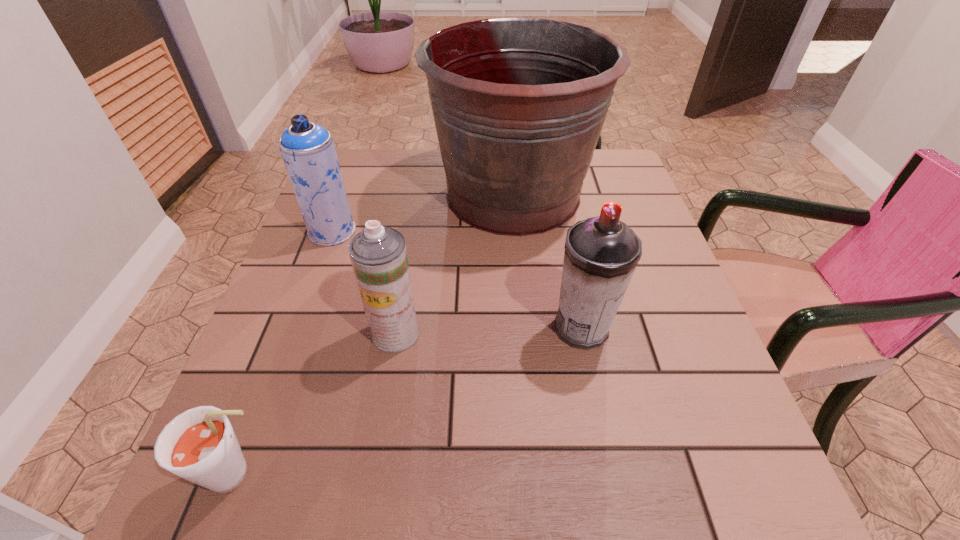
Where is `vacant space located 0.130m on the drink side of the shortest object`? This screenshot has height=540, width=960. vacant space located 0.130m on the drink side of the shortest object is located at coordinates (365, 475).

Where is `object positioned at the far edge`? object positioned at the far edge is located at coordinates (519, 104).

Locate an element on the screen. The width and height of the screenshot is (960, 540). object that is at the near edge is located at coordinates (199, 445).

At what (x,y) coordinates should I click in order to perform the action: click on aerosol can that is at the left edge. Please return your answer as a coordinate pair (x, y). This screenshot has width=960, height=540. Looking at the image, I should click on (308, 151).

Where is `root beer located in the left edge section of the desktop`? The width and height of the screenshot is (960, 540). root beer located in the left edge section of the desktop is located at coordinates (199, 445).

Locate an element on the screen. This screenshot has width=960, height=540. bucket present at the right edge is located at coordinates [519, 104].

The width and height of the screenshot is (960, 540). Identify the location of aerosol can located in the right edge section of the desktop. (601, 253).

You are a GUI agent. You are given a task and a screenshot of the screen. Output one action in this format:
    pyautogui.click(x=<x>, y=<y>)
    Task: Click on the object at the near left corner
    
    Given the screenshot: What is the action you would take?
    [x=199, y=445]

You are a GUI agent. You are given a task and a screenshot of the screen. Output one action in this format:
    pyautogui.click(x=<x>, y=<y>)
    Task: Click on the object present at the far right corner
    
    Given the screenshot: What is the action you would take?
    pyautogui.click(x=519, y=104)

You are a GUI agent. You are given a task and a screenshot of the screen. Output one action in this format:
    pyautogui.click(x=<x>, y=<y>)
    Task: Click on the free region at the near edge
    This screenshot has height=540, width=960.
    Given the screenshot: What is the action you would take?
    pyautogui.click(x=542, y=487)